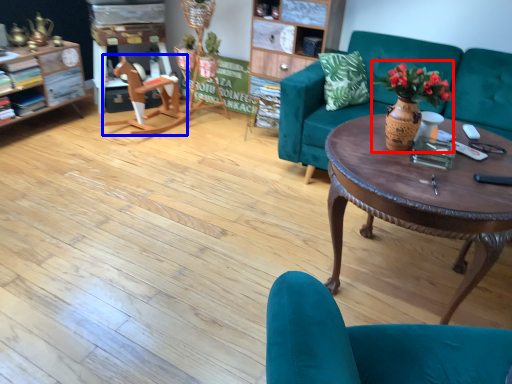
Question: Which point is closer to the camera, floral arrangement (highlighted by a red box) or wide (highlighted by a blue box)?

Choices:
 (A) floral arrangement
 (B) wide

Answer: (A)